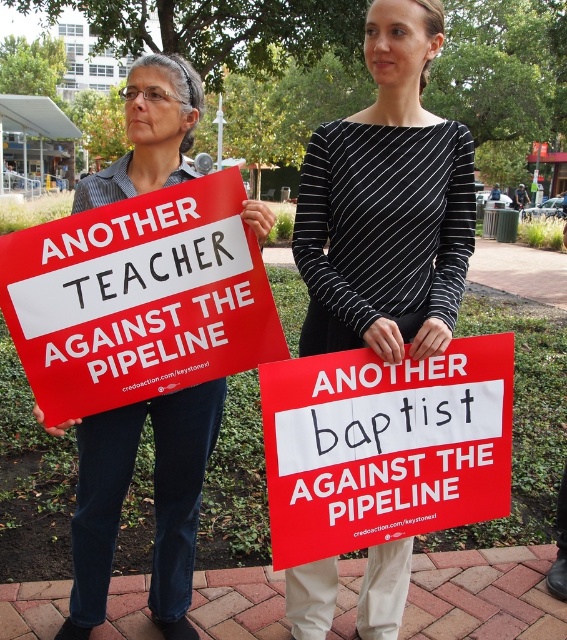
You are a photographer trying to capture both the red matte sign at center and the matte black shirt at center in the same frame. The minimum distance between the two objects must be at least 20 inches for the camera to focus properly. Can you fit both in the frame without moving the camera?

The red matte sign at center is 19.71 inches away from the matte black shirt at center. Since the required minimum distance is 20 inches, the camera cannot focus properly, so you cannot fit both in the frame without moving the camera.

You are a photographer trying to capture both the red matte sign at left and the matte black shirt at center in a single frame. Based on the scene, which object should you focus on first to ensure both are in the frame?

The red matte sign at left might be wider than the matte black shirt at center, so focusing on the wider object first would help ensure both fit within the frame.

You are a photographer trying to capture both individuals holding their protest signs. Since you want to ensure both the black striped shirt at center and the matte black shirt at center are clearly visible in your photo, which one should you focus on first to avoid blurriness if the person moves?

The black striped shirt at center should be focused on first because it is positioned on the right side of the matte black shirt at center, so capturing it first would ensure both are in focus before movement occurs.